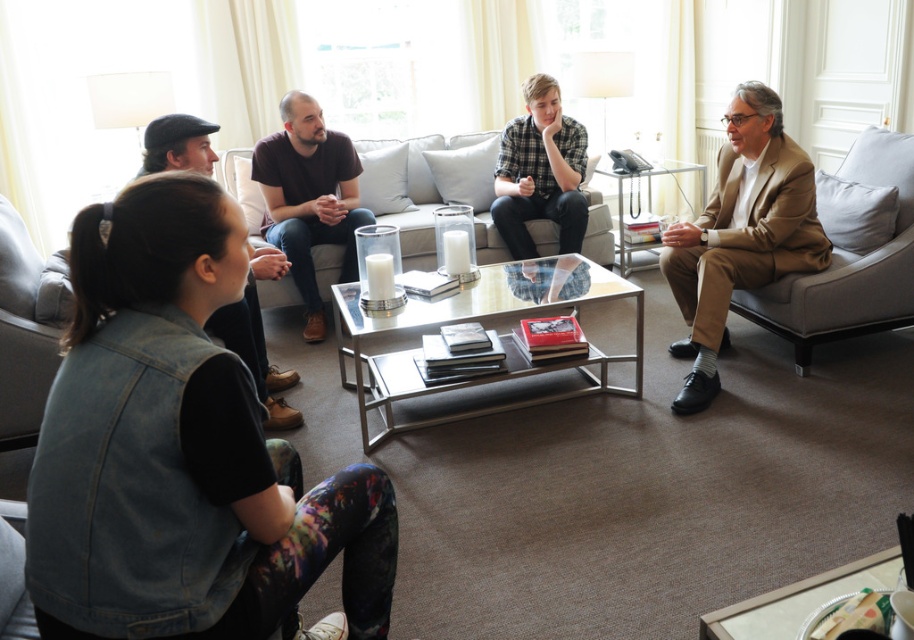
Based on the photo, you are a photographer setting up a shot of the living room scene. You need to ensure that both the plaid shirt at center and the denim vest at lower left are visible in the frame. Given their heights, which one might you need to adjust your camera angle to include fully?

The plaid shirt at center is much taller than the denim vest at lower left, so you might need to adjust the camera angle to capture the full height of the plaid shirt at center.

You are standing at the location of the camera in the living room. Which object is farther from you, the plaid shirt at center or the camera itself?

The plaid shirt at center is farther from the camera since they are 3.98 meters apart.

You are standing in the living room and want to reach the point at coordinates point (710, 305). The room has a sofa and an armchair. Are you able to walk directly to that point without moving any furniture?

The point at coordinates point (710, 305) is 2.98 meters away from the viewer. Since there is a sofa and an armchair in the room, but the description does not mention any obstruction between you and the point, it is likely possible to walk directly to that point without moving any furniture.